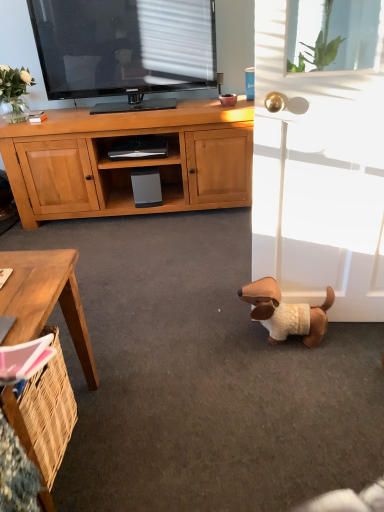
Question: Is brown plush dog at lower right shorter than transparent glass window screen at upper right?

Choices:
 (A) no
 (B) yes

Answer: (B)

Question: Considering the relative sizes of brown plush dog at lower right and transparent glass window screen at upper right in the image provided, is brown plush dog at lower right bigger than transparent glass window screen at upper right?

Choices:
 (A) yes
 (B) no

Answer: (B)

Question: Considering the relative sizes of brown plush dog at lower right and transparent glass window screen at upper right in the image provided, is brown plush dog at lower right thinner than transparent glass window screen at upper right?

Choices:
 (A) no
 (B) yes

Answer: (B)

Question: Is brown plush dog at lower right positioned with its back to transparent glass window screen at upper right?

Choices:
 (A) no
 (B) yes

Answer: (A)

Question: Is brown plush dog at lower right not inside transparent glass window screen at upper right?

Choices:
 (A) yes
 (B) no

Answer: (A)

Question: From a real-world perspective, is brown wooden desk at lower left physically located above or below brown plush dog at lower right?

Choices:
 (A) below
 (B) above

Answer: (B)

Question: From the image's perspective, is brown wooden desk at lower left above or below brown plush dog at lower right?

Choices:
 (A) above
 (B) below

Answer: (B)

Question: Is brown wooden desk at lower left spatially inside brown plush dog at lower right, or outside of it?

Choices:
 (A) inside
 (B) outside

Answer: (B)

Question: In the image, is brown wooden desk at lower left positioned in front of or behind brown plush dog at lower right?

Choices:
 (A) behind
 (B) front

Answer: (B)

Question: Would you say white matte screen door at lower right is to the left or to the right of transparent glass window screen at upper right in the picture?

Choices:
 (A) left
 (B) right

Answer: (A)

Question: Which is correct: white matte screen door at lower right is inside transparent glass window screen at upper right, or outside of it?

Choices:
 (A) inside
 (B) outside

Answer: (B)

Question: From a real-world perspective, is white matte screen door at lower right above or below transparent glass window screen at upper right?

Choices:
 (A) above
 (B) below

Answer: (B)

Question: Considering the positions of point (271, 214) and point (327, 69), is point (271, 214) closer or farther from the camera than point (327, 69)?

Choices:
 (A) farther
 (B) closer

Answer: (B)

Question: From their relative heights in the image, would you say white matte screen door at lower right is taller or shorter than white glass vase at upper left?

Choices:
 (A) tall
 (B) short

Answer: (A)

Question: Choose the correct answer: Is white matte screen door at lower right inside white glass vase at upper left or outside it?

Choices:
 (A) inside
 (B) outside

Answer: (B)